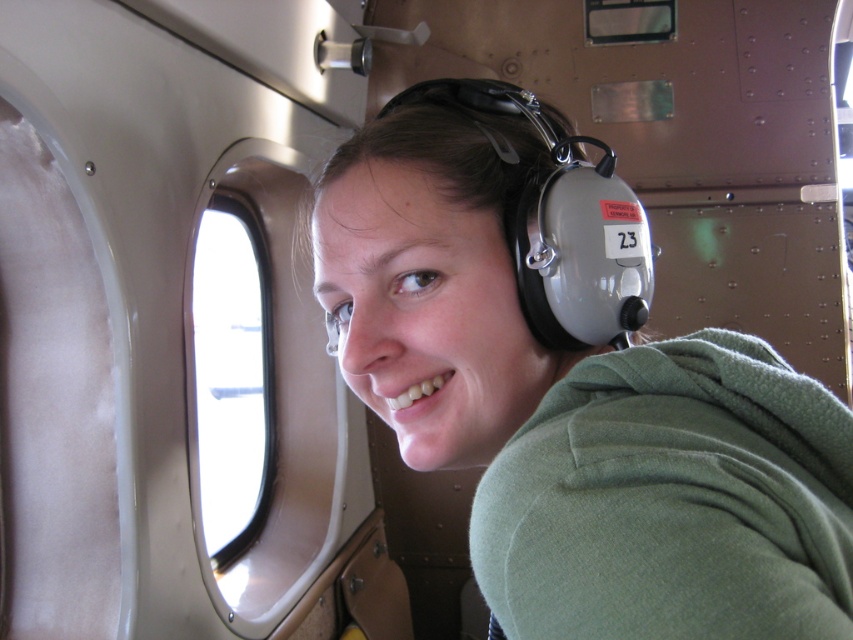
Question: Can you confirm if green fleece sweatshirt at center is positioned below transparent glass airplane window at upper left?

Choices:
 (A) no
 (B) yes

Answer: (A)

Question: Which of the following is the farthest from the observer?

Choices:
 (A) transparent glass airplane window at upper left
 (B) green fleece at center
 (C) green fleece sweatshirt at center

Answer: (A)

Question: Which point is closer to the camera?

Choices:
 (A) (663, 488)
 (B) (809, 570)

Answer: (B)

Question: Considering the real-world distances, which object is farthest from the green fleece at center?

Choices:
 (A) transparent glass airplane window at upper left
 (B) green fleece sweatshirt at center

Answer: (A)

Question: Does green fleece sweatshirt at center appear on the left side of transparent glass airplane window at upper left?

Choices:
 (A) yes
 (B) no

Answer: (B)

Question: Can you confirm if green fleece at center is wider than green fleece sweatshirt at center?

Choices:
 (A) no
 (B) yes

Answer: (B)